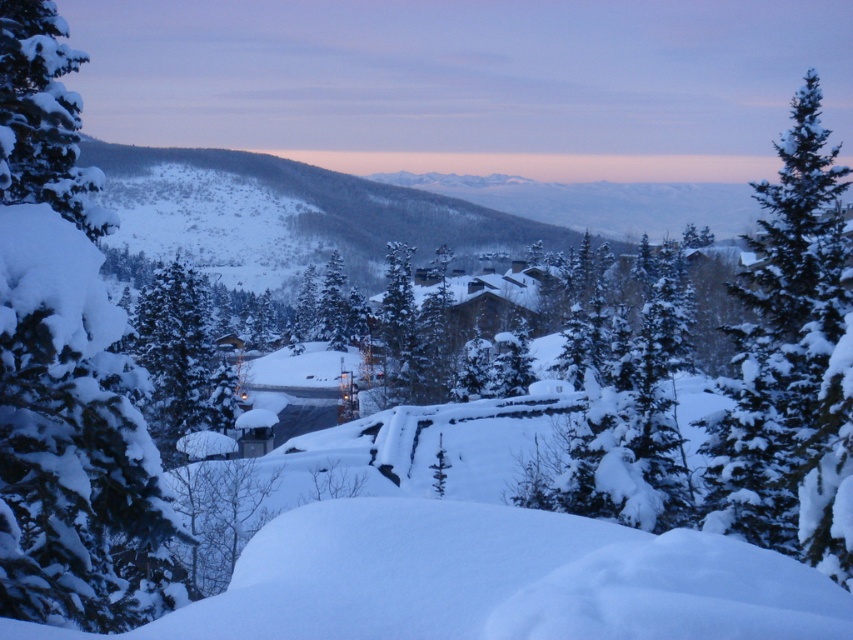
Question: Which point appears closest to the camera in this image?

Choices:
 (A) (1, 1)
 (B) (782, 205)

Answer: (A)

Question: Does snow-covered evergreen at left have a smaller size compared to snow-covered evergreen at center-right?

Choices:
 (A) no
 (B) yes

Answer: (B)

Question: Is the position of snow-covered evergreen at left less distant than that of snow-covered evergreen at center-right?

Choices:
 (A) no
 (B) yes

Answer: (B)

Question: Is snow-covered evergreen at left to the right of snow-covered evergreen at center-right from the viewer's perspective?

Choices:
 (A) no
 (B) yes

Answer: (A)

Question: Among these points, which one is nearest to the camera?

Choices:
 (A) (737, 339)
 (B) (25, 275)

Answer: (B)

Question: Among these points, which one is nearest to the camera?

Choices:
 (A) (778, 314)
 (B) (24, 164)

Answer: (B)